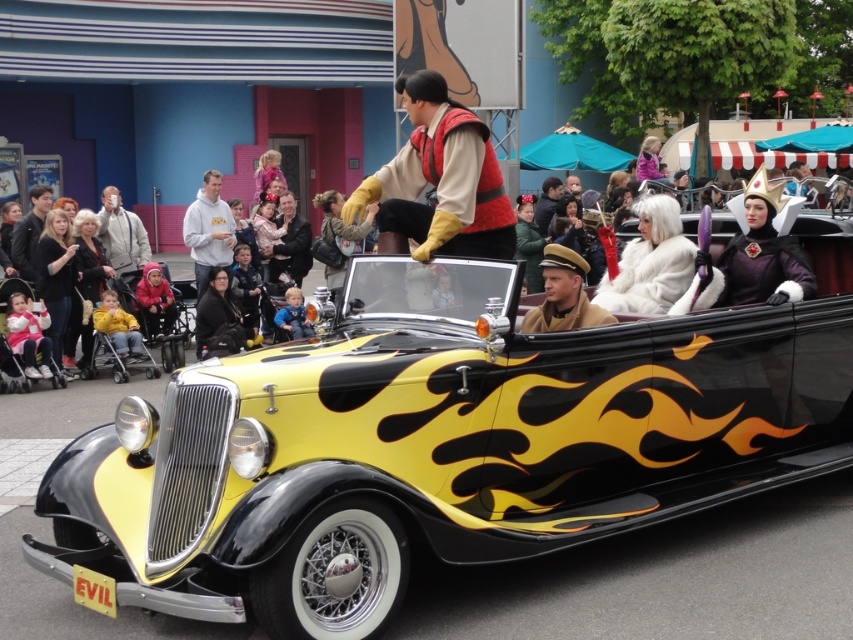
Is point (767, 180) in front of point (229, 246)?

Yes, point (767, 180) is in front of point (229, 246).

Who is positioned more to the left, shiny purple crown at upper right or white fleece sweatshirt at center?

white fleece sweatshirt at center

Who is more distant from viewer, (763, 243) or (193, 246)?

Positioned behind is point (193, 246).

You are a GUI agent. You are given a task and a screenshot of the screen. Output one action in this format:
    pyautogui.click(x=<x>, y=<y>)
    Task: Click on the shiny purple crown at upper right
    
    Given the screenshot: What is the action you would take?
    pyautogui.click(x=763, y=253)

Does white fleece sweatshirt at center have a greater height compared to black fur coat at center?

Yes.

Is the position of white fleece sweatshirt at center less distant than that of black fur coat at center?

No, it is behind black fur coat at center.

This screenshot has width=853, height=640. In order to click on white fleece sweatshirt at center in this screenshot , I will do pos(207,230).

The width and height of the screenshot is (853, 640). Identify the location of white fleece sweatshirt at center. (207, 230).

In the scene shown: Is brown leather hat at center below white fleece sweatshirt at center?

Yes.

Does brown leather hat at center have a greater width compared to white fleece sweatshirt at center?

In fact, brown leather hat at center might be narrower than white fleece sweatshirt at center.

Locate an element on the screen. The width and height of the screenshot is (853, 640). brown leather hat at center is located at coordinates (563, 296).